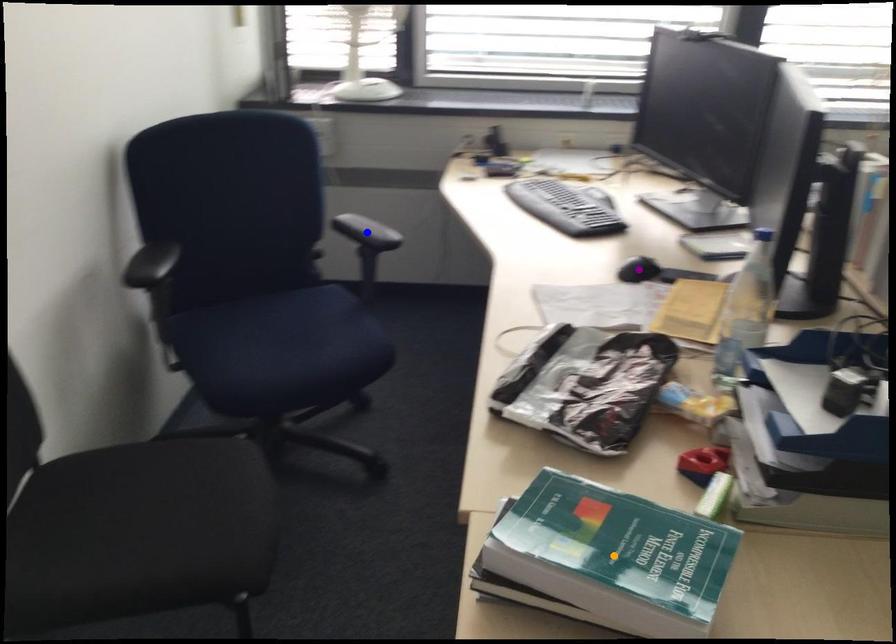
Order these from farthest to nearest:
blue point | purple point | orange point

blue point, purple point, orange point